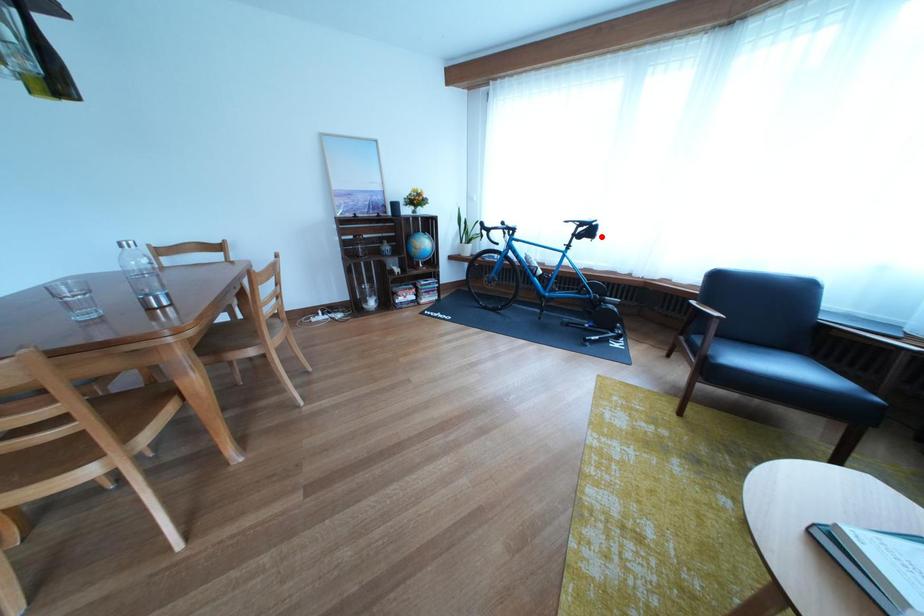
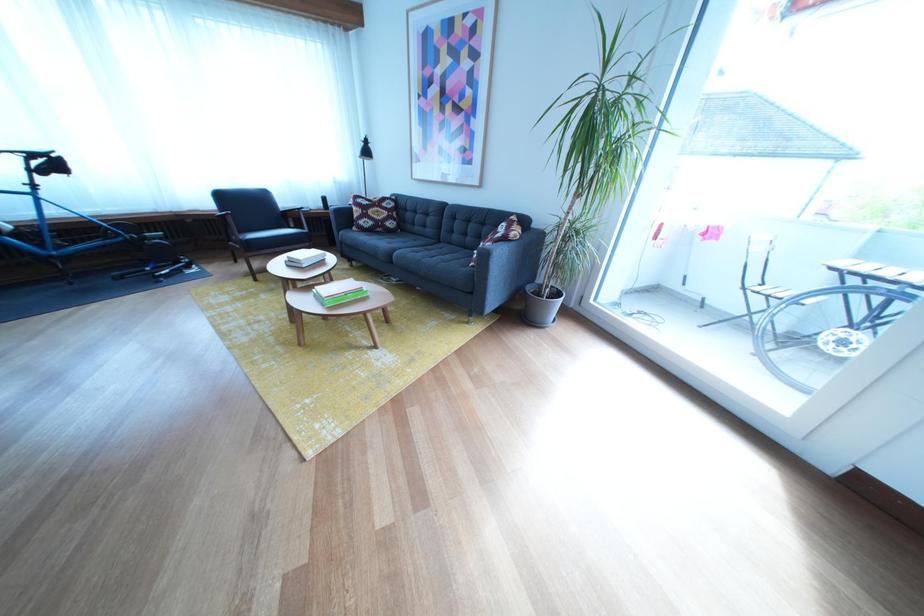
The point at the highlighted location is marked in the first image. Where is the corresponding point in the second image?

(64, 169)